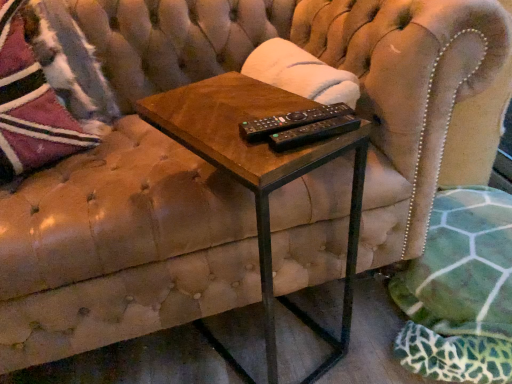
Question: Is velvet textured throw pillow at upper left smaller than woodenmaterial/texturetable at center?

Choices:
 (A) no
 (B) yes

Answer: (B)

Question: Does velvet textured throw pillow at upper left appear on the left side of woodenmaterial/texturetable at center?

Choices:
 (A) yes
 (B) no

Answer: (A)

Question: Does velvet textured throw pillow at upper left have a greater width compared to woodenmaterial/texturetable at center?

Choices:
 (A) no
 (B) yes

Answer: (A)

Question: Is velvet textured throw pillow at upper left at the right side of woodenmaterial/texturetable at center?

Choices:
 (A) yes
 (B) no

Answer: (B)

Question: Is velvet textured throw pillow at upper left positioned before woodenmaterial/texturetable at center?

Choices:
 (A) no
 (B) yes

Answer: (A)

Question: From the image's perspective, is black plastic remote controls at center positioned above or below green fabric swivel chair at lower right?

Choices:
 (A) above
 (B) below

Answer: (A)

Question: Choose the correct answer: Is black plastic remote controls at center inside green fabric swivel chair at lower right or outside it?

Choices:
 (A) outside
 (B) inside

Answer: (A)

Question: From a real-world perspective, relative to green fabric swivel chair at lower right, is black plastic remote controls at center vertically above or below?

Choices:
 (A) below
 (B) above

Answer: (B)

Question: Based on their sizes in the image, would you say black plastic remote controls at center is bigger or smaller than green fabric swivel chair at lower right?

Choices:
 (A) big
 (B) small

Answer: (B)

Question: From the image's perspective, is velvet textured throw pillow at upper left located above or below green fabric swivel chair at lower right?

Choices:
 (A) above
 (B) below

Answer: (A)

Question: Visually, is velvet textured throw pillow at upper left positioned to the left or to the right of green fabric swivel chair at lower right?

Choices:
 (A) left
 (B) right

Answer: (A)

Question: Considering the positions of velvet textured throw pillow at upper left and green fabric swivel chair at lower right in the image, is velvet textured throw pillow at upper left wider or thinner than green fabric swivel chair at lower right?

Choices:
 (A) thin
 (B) wide

Answer: (A)

Question: Considering the positions of velvet textured throw pillow at upper left and green fabric swivel chair at lower right in the image, is velvet textured throw pillow at upper left taller or shorter than green fabric swivel chair at lower right?

Choices:
 (A) short
 (B) tall

Answer: (B)

Question: Based on their sizes in the image, would you say black plastic remote controls at center is bigger or smaller than black plastic remote at center?

Choices:
 (A) small
 (B) big

Answer: (B)

Question: Considering the positions of black plastic remote controls at center and black plastic remote at center in the image, is black plastic remote controls at center taller or shorter than black plastic remote at center?

Choices:
 (A) tall
 (B) short

Answer: (A)